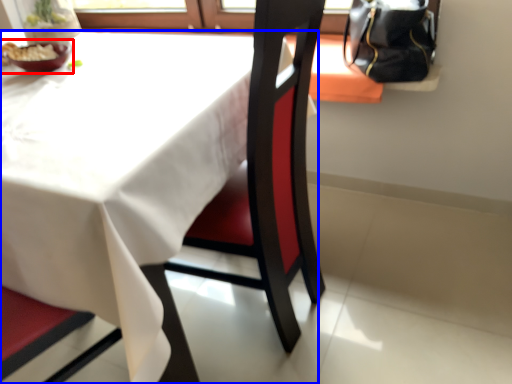
Question: Which object appears farthest to the camera in this image, tableware (highlighted by a red box) or table (highlighted by a blue box)?

Choices:
 (A) tableware
 (B) table

Answer: (A)